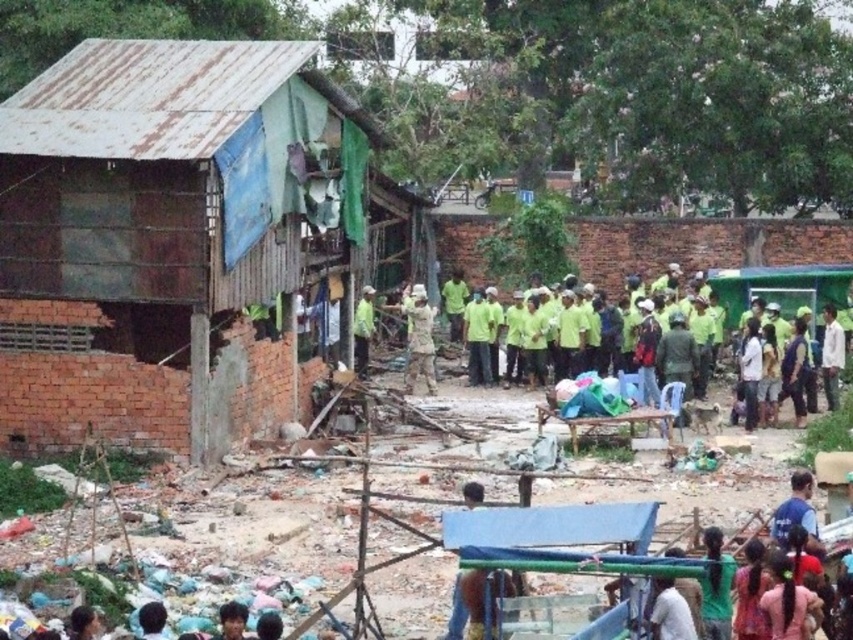
Is camouflage fabric uniform at center positioned behind green matte shirt at center?

No, it is in front of green matte shirt at center.

Who is positioned more to the right, camouflage fabric uniform at center or green matte shirt at center?

camouflage fabric uniform at center

Between point (416, 296) and point (352, 336), which one is positioned behind?

The point (416, 296) is behind.

You are a GUI agent. You are given a task and a screenshot of the screen. Output one action in this format:
    pyautogui.click(x=<x>, y=<y>)
    Task: Click on the camouflage fabric uniform at center
    This screenshot has height=640, width=853.
    Given the screenshot: What is the action you would take?
    pyautogui.click(x=419, y=339)

Can you confirm if rusty metal hut at left is bigger than dark brown hair at lower left?

Correct, rusty metal hut at left is larger in size than dark brown hair at lower left.

Who is more distant from viewer, (209, 61) or (148, 621)?

The point (209, 61) is behind.

Is point (117, 188) closer to viewer compared to point (154, 630)?

No.

Where is `rusty metal hut at left`? Image resolution: width=853 pixels, height=640 pixels. rusty metal hut at left is located at coordinates (172, 240).

Can you confirm if rusty metal hut at left is taller than smooth brown hair at lower center?

Yes, rusty metal hut at left is taller than smooth brown hair at lower center.

The image size is (853, 640). Describe the element at coordinates (172, 240) in the screenshot. I see `rusty metal hut at left` at that location.

At what (x,y) coordinates should I click in order to perform the action: click on rusty metal hut at left. Please return your answer as a coordinate pair (x, y). Looking at the image, I should click on (172, 240).